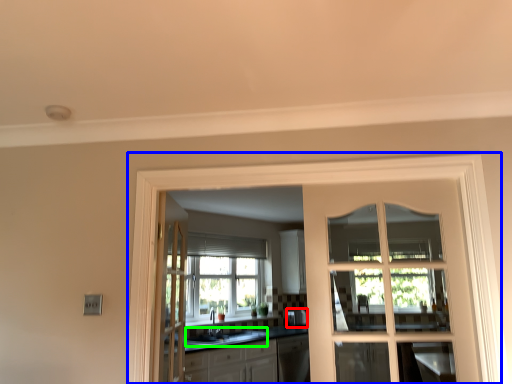
Question: Considering the real-world distances, which object is closest to appliance (highlighted by a red box)? window frame (highlighted by a blue box) or sink (highlighted by a green box).

Choices:
 (A) window frame
 (B) sink

Answer: (B)